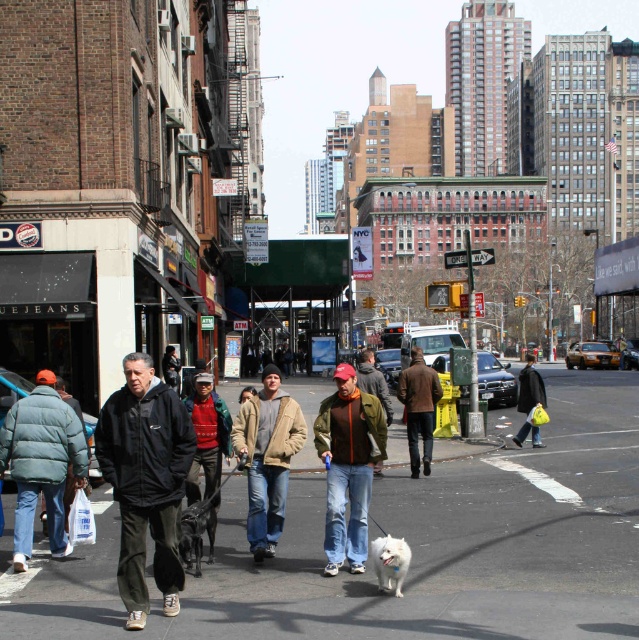
Question: In this image, where is knitted sweater at center located relative to brown leather jacket at center?

Choices:
 (A) right
 (B) left

Answer: (B)

Question: Is knitted sweater at center bigger than shiny black dog at center?

Choices:
 (A) no
 (B) yes

Answer: (B)

Question: Which object appears farthest from the camera in this image?

Choices:
 (A) green puffer jacket at lower left
 (B) white fluffy dog at lower center
 (C) shiny black dog at center
 (D) brown leather jacket at center

Answer: (D)

Question: Can you confirm if white fluffy dog at lower center is wider than black leather jacket at center?

Choices:
 (A) no
 (B) yes

Answer: (A)

Question: Which point is farther from the camera taking this photo?

Choices:
 (A) (167, 371)
 (B) (364, 458)
 (C) (380, 541)

Answer: (A)

Question: Which of the following is the closest to the observer?

Choices:
 (A) black leather jacket at center
 (B) green matte jacket at center
 (C) black matte jacket at center

Answer: (C)